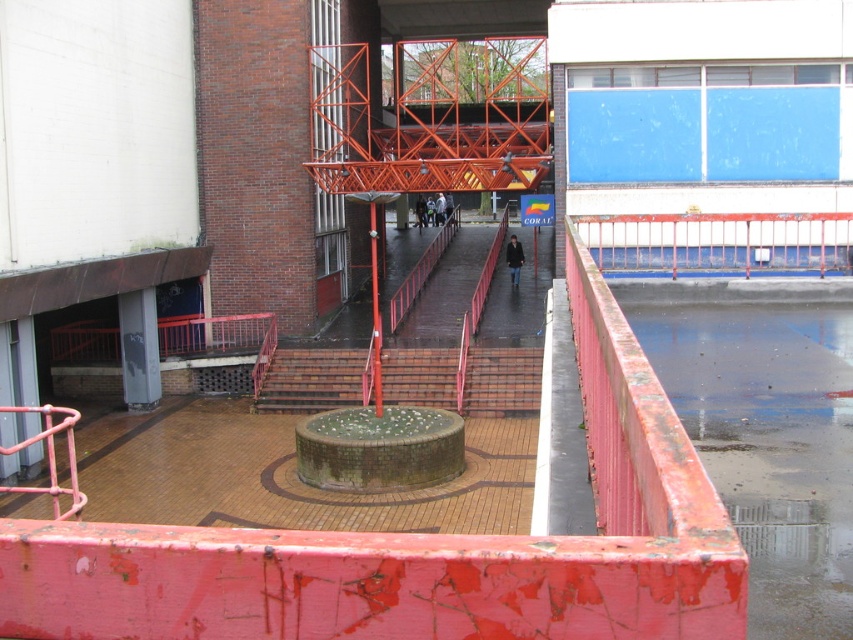
Is rusty metal railing at center taller than orange metallic fire escape at center?

No.

What do you see at coordinates (422, 547) in the screenshot? I see `rusty metal railing at center` at bounding box center [422, 547].

Identify the location of rusty metal railing at center. (422, 547).

The image size is (853, 640). I want to click on rusty metal railing at center, so click(422, 547).

Which of these two, orange metallic fire escape at center or brick stairs at center, stands taller?

With more height is orange metallic fire escape at center.

The image size is (853, 640). Find the location of `orange metallic fire escape at center`. orange metallic fire escape at center is located at coordinates (432, 116).

Where is `rusty metal railing at center`? The image size is (853, 640). rusty metal railing at center is located at coordinates (422, 547).

Is point (599, 465) closer to viewer compared to point (606, 262)?

That is True.

You are a GUI agent. You are given a task and a screenshot of the screen. Output one action in this format:
    pyautogui.click(x=<x>, y=<y>)
    Task: Click on the rusty metal railing at center
    
    Given the screenshot: What is the action you would take?
    pyautogui.click(x=422, y=547)